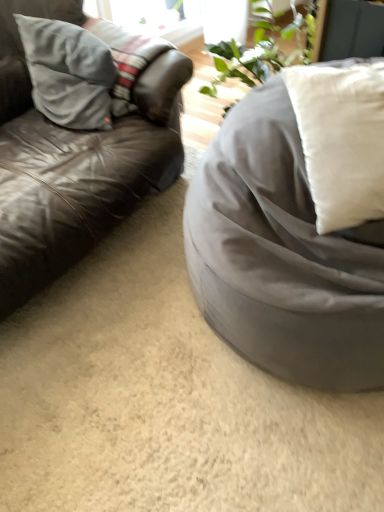
This screenshot has width=384, height=512. Describe the element at coordinates (341, 140) in the screenshot. I see `white soft cushion at right, which is the second pillow from left to right` at that location.

What do you see at coordinates (282, 256) in the screenshot? I see `satin gray bean bag at right` at bounding box center [282, 256].

The height and width of the screenshot is (512, 384). I want to click on leather couch at left, so click(74, 162).

Is suede gray pillow at left, the second pillow when ordered from front to back, oriented away from leather couch at left?

Correct, suede gray pillow at left, the second pillow when ordered from front to back, is looking away from leather couch at left.

Considering the positions of point (84, 47) and point (39, 278), is point (84, 47) closer or farther from the camera than point (39, 278)?

Point (84, 47).

Measure the distance between suede gray pillow at left, the second pillow when ordered from front to back, and leather couch at left.

A distance of 7.01 inches exists between suede gray pillow at left, the second pillow when ordered from front to back, and leather couch at left.

Is leather couch at left a part of suede gray pillow at left, the 2th pillow from the right?

No, leather couch at left is not inside suede gray pillow at left, the 2th pillow from the right.

Considering the positions of objects suede gray pillow at left, the 1th pillow viewed from the back, and satin gray bean bag at right in the image provided, who is more to the left, suede gray pillow at left, the 1th pillow viewed from the back, or satin gray bean bag at right?

suede gray pillow at left, the 1th pillow viewed from the back.

Is suede gray pillow at left, the second pillow when ordered from front to back, shorter than satin gray bean bag at right?

Yes.

Considering their positions, is suede gray pillow at left, the 1th pillow viewed from the back, located in front of or behind satin gray bean bag at right?

In the image, suede gray pillow at left, the 1th pillow viewed from the back, appears behind satin gray bean bag at right.

Based on the photo, what's the angular difference between suede gray pillow at left, the 2th pillow from the right, and satin gray bean bag at right's facing directions?

The facing directions of suede gray pillow at left, the 2th pillow from the right, and satin gray bean bag at right are 3.27 degrees apart.

In the scene shown: Between white soft cushion at right, which is the second pillow from back to front, and satin gray bean bag at right, which one has smaller size?

Smaller between the two is white soft cushion at right, which is the second pillow from back to front.

Does point (342, 148) appear closer or farther from the camera than point (309, 191)?

Point (342, 148).

Find the location of `the 2nd pillow directly above the satin gray bean bag at right (from a real-world perspective)`. the 2nd pillow directly above the satin gray bean bag at right (from a real-world perspective) is located at coordinates (341, 140).

How many degrees apart are the facing directions of white soft cushion at right, positioned as the 1th pillow in right-to-left order, and satin gray bean bag at right?

white soft cushion at right, positioned as the 1th pillow in right-to-left order, and satin gray bean bag at right are facing 44.1 degrees away from each other.

In the scene shown: Is suede gray pillow at left, the 2th pillow from the right, facing away from white soft cushion at right, which is the second pillow from left to right?

No, suede gray pillow at left, the 2th pillow from the right,'s orientation is not away from white soft cushion at right, which is the second pillow from left to right.

Can you confirm if suede gray pillow at left, the 2th pillow from the right, is bigger than white soft cushion at right, which is the second pillow from left to right?

No.

From the image's perspective, is suede gray pillow at left, the 1th pillow positioned from the left, positioned above or below white soft cushion at right, arranged as the 1th pillow when viewed from the front?

Based on their image positions, suede gray pillow at left, the 1th pillow positioned from the left, is located above white soft cushion at right, arranged as the 1th pillow when viewed from the front.

Is suede gray pillow at left, the 1th pillow positioned from the left, wider or thinner than white soft cushion at right, which is the second pillow from left to right?

Considering their sizes, suede gray pillow at left, the 1th pillow positioned from the left, looks slimmer than white soft cushion at right, which is the second pillow from left to right.

Is leather couch at left placed right next to satin gray bean bag at right?

No.

How much distance is there between leather couch at left and satin gray bean bag at right?

leather couch at left is 21.98 inches from satin gray bean bag at right.

Looking at this image, is leather couch at left facing towards satin gray bean bag at right?

Yes, leather couch at left faces towards satin gray bean bag at right.

What's the angular difference between leather couch at left and satin gray bean bag at right's facing directions?

The facing directions of leather couch at left and satin gray bean bag at right are 91 degrees apart.

In the image, there is a leather couch at left. Where is `pillow above it (from the image's perspective)`? pillow above it (from the image's perspective) is located at coordinates (68, 72).

Which is closer, (25, 157) or (40, 25)?

Point (25, 157)

Is leather couch at left positioned far away from suede gray pillow at left, the 1th pillow viewed from the back?

No, leather couch at left is not far away from suede gray pillow at left, the 1th pillow viewed from the back.

Is leather couch at left turned away from suede gray pillow at left, the second pillow when ordered from front to back?

That's right, leather couch at left is facing away from suede gray pillow at left, the second pillow when ordered from front to back.

Measure the distance from white soft cushion at right, which is the second pillow from left to right, to leather couch at left.

A distance of 27.64 inches exists between white soft cushion at right, which is the second pillow from left to right, and leather couch at left.

Is white soft cushion at right, arranged as the 1th pillow when viewed from the front, surrounding leather couch at left?

Definitely not — leather couch at left is not inside white soft cushion at right, arranged as the 1th pillow when viewed from the front.

From a real-world perspective, is white soft cushion at right, arranged as the 1th pillow when viewed from the front, on leather couch at left?

Indeed, from a real-world perspective, white soft cushion at right, arranged as the 1th pillow when viewed from the front, stands above leather couch at left.

Is white soft cushion at right, positioned as the 1th pillow in right-to-left order, positioned with its back to leather couch at left?

No, white soft cushion at right, positioned as the 1th pillow in right-to-left order,'s orientation is not away from leather couch at left.

Where is `pillow above the leather couch at left (from the image's perspective)`? This screenshot has width=384, height=512. pillow above the leather couch at left (from the image's perspective) is located at coordinates (68, 72).

Locate an element on the screen. pillow lying on the left of satin gray bean bag at right is located at coordinates (68, 72).

Looking at the image, which one is located closer to leather couch at left, white soft cushion at right, which is the second pillow from left to right, or suede gray pillow at left, the second pillow when ordered from front to back?

suede gray pillow at left, the second pillow when ordered from front to back.

From the image, which object appears to be farther from white soft cushion at right, which is the second pillow from back to front, leather couch at left or suede gray pillow at left, the second pillow when ordered from front to back?

suede gray pillow at left, the second pillow when ordered from front to back.

Estimate the real-world distances between objects in this image. Which object is closer to suede gray pillow at left, the 1th pillow viewed from the back, leather couch at left or satin gray bean bag at right?

leather couch at left is closer to suede gray pillow at left, the 1th pillow viewed from the back.

Looking at the image, which one is located further to white soft cushion at right, arranged as the 1th pillow when viewed from the front, leather couch at left or satin gray bean bag at right?

leather couch at left.

Estimate the real-world distances between objects in this image. Which object is further from leather couch at left, suede gray pillow at left, the 1th pillow positioned from the left, or white soft cushion at right, positioned as the 1th pillow in right-to-left order?

Among the two, white soft cushion at right, positioned as the 1th pillow in right-to-left order, is located further to leather couch at left.

Estimate the real-world distances between objects in this image. Which object is further from satin gray bean bag at right, suede gray pillow at left, the 1th pillow viewed from the back, or white soft cushion at right, which is the second pillow from left to right?

suede gray pillow at left, the 1th pillow viewed from the back, lies further to satin gray bean bag at right than the other object.

Which object lies further to the anchor point suede gray pillow at left, the 1th pillow positioned from the left, white soft cushion at right, positioned as the 1th pillow in right-to-left order, or satin gray bean bag at right?

Based on the image, white soft cushion at right, positioned as the 1th pillow in right-to-left order, appears to be further to suede gray pillow at left, the 1th pillow positioned from the left.

Estimate the real-world distances between objects in this image. Which object is further from satin gray bean bag at right, suede gray pillow at left, the 2th pillow from the right, or leather couch at left?

suede gray pillow at left, the 2th pillow from the right, is positioned further to the anchor satin gray bean bag at right.

What are the coordinates of `furniture situated between leather couch at left and white soft cushion at right, arranged as the 1th pillow when viewed from the front, from left to right` in the screenshot? It's located at (282, 256).

Where is `furniture between suede gray pillow at left, the second pillow when ordered from front to back, and white soft cushion at right, positioned as the 1th pillow in right-to-left order, from left to right`? The height and width of the screenshot is (512, 384). furniture between suede gray pillow at left, the second pillow when ordered from front to back, and white soft cushion at right, positioned as the 1th pillow in right-to-left order, from left to right is located at coordinates (282, 256).

What are the coordinates of `pillow between leather couch at left and white soft cushion at right, positioned as the 1th pillow in right-to-left order, in the horizontal direction` in the screenshot? It's located at (68, 72).

Identify the location of pillow situated between leather couch at left and satin gray bean bag at right from left to right. (68, 72).